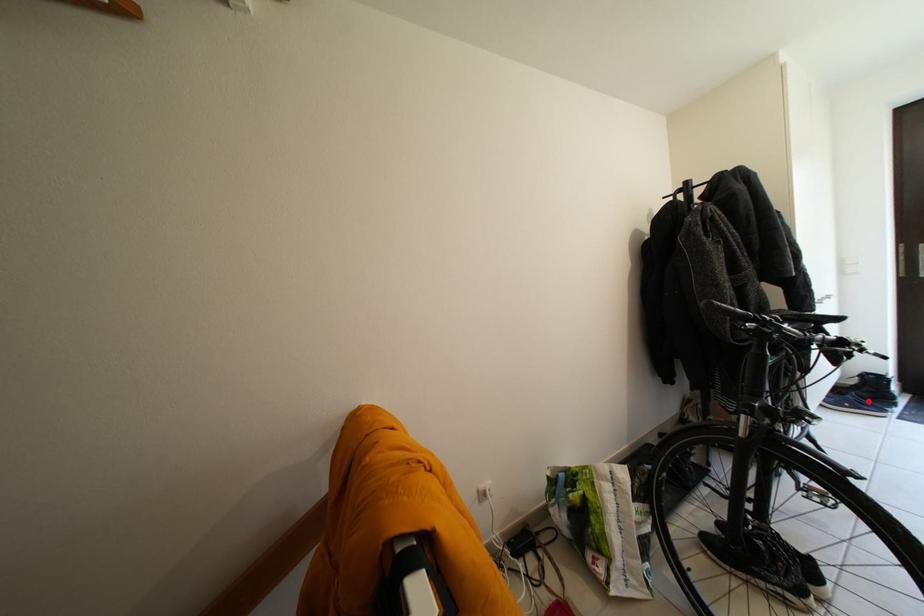
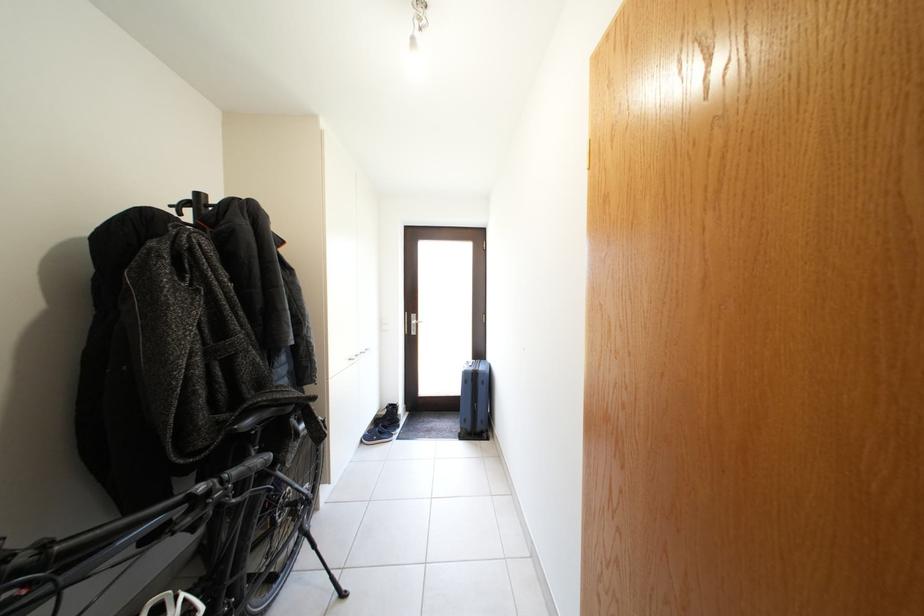
Locate, in the second image, the point that corresponds to the highlighted location in the first image.

(392, 431)